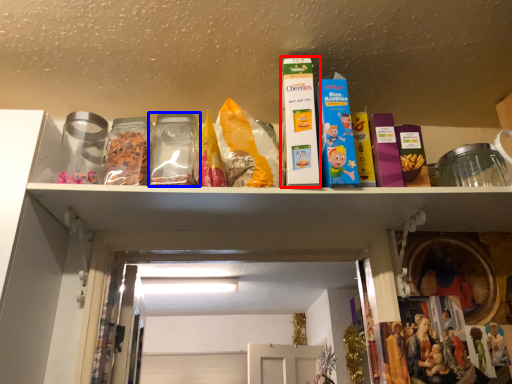
Question: Which object is closer to the camera taking this photo, product (highlighted by a red box) or glass jar (highlighted by a blue box)?

Choices:
 (A) product
 (B) glass jar

Answer: (A)